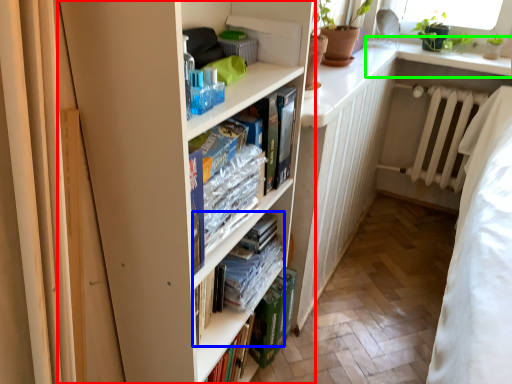
Question: Based on their relative distances, which object is nearer to bookcase (highlighted by a red box)? Choose from book (highlighted by a blue box) and window sill (highlighted by a green box).

Choices:
 (A) book
 (B) window sill

Answer: (A)